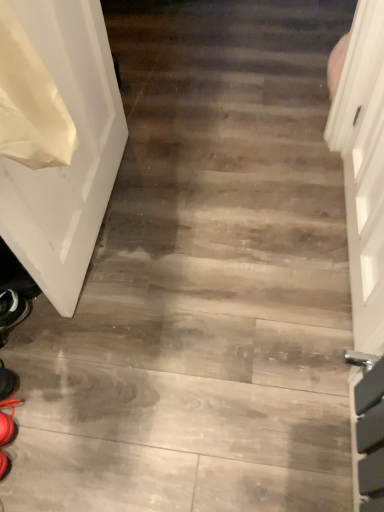
Question: Is point (1, 362) positioned closer to the camera than point (91, 53)?

Choices:
 (A) farther
 (B) closer

Answer: (B)

Question: From a real-world perspective, relative to white glossy door at left, is shiny black shoe at lower left vertically above or below?

Choices:
 (A) below
 (B) above

Answer: (A)

Question: Is shiny black shoe at lower left wider or thinner than white glossy door at left?

Choices:
 (A) thin
 (B) wide

Answer: (B)

Question: In terms of size, does white glossy door at left appear bigger or smaller than shiny black shoe at lower left?

Choices:
 (A) small
 (B) big

Answer: (B)

Question: From a real-world perspective, is white glossy door at left physically located above or below shiny black shoe at lower left?

Choices:
 (A) below
 (B) above

Answer: (B)

Question: Is point (18, 2) positioned closer to the camera than point (4, 382)?

Choices:
 (A) closer
 (B) farther

Answer: (A)

Question: Relative to shiny black shoe at lower left, is white glossy door at left in front or behind?

Choices:
 (A) front
 (B) behind

Answer: (A)